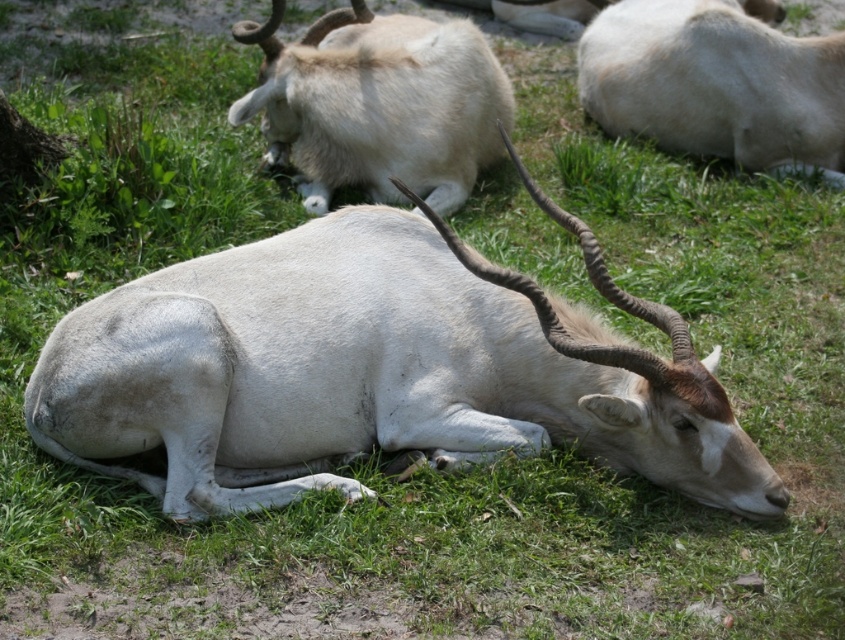
At what (x,y) coordinates should I click in order to perform the action: click on white matte antelope at center. Please return your answer as a coordinate pair (x, y). The image size is (845, 640). Looking at the image, I should click on (375, 369).

Is white matte antelope at center closer to the viewer compared to white woolly antelope at upper right?

That is True.

Identify the location of white matte antelope at center. (375, 369).

Is point (379, 419) closer to viewer compared to point (453, 147)?

That is True.

Who is shorter, white matte antelope at center or white woolly antelope at upper center?

white woolly antelope at upper center

I want to click on white matte antelope at center, so click(x=375, y=369).

Identify the location of white matte antelope at center. (375, 369).

Between white woolly antelope at upper center and white woolly antelope at upper right, which one is positioned lower?

white woolly antelope at upper center

Which of these two, white woolly antelope at upper center or white woolly antelope at upper right, stands shorter?

white woolly antelope at upper center is shorter.

Is point (507, 120) positioned in front of point (724, 108)?

No, it is not.

Identify the location of white woolly antelope at upper center. (379, 104).